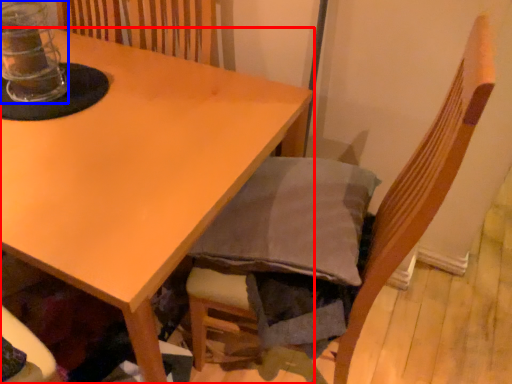
Question: Which point is closer to the camera, table (highlighted by a red box) or glass jar (highlighted by a blue box)?

Choices:
 (A) table
 (B) glass jar

Answer: (A)